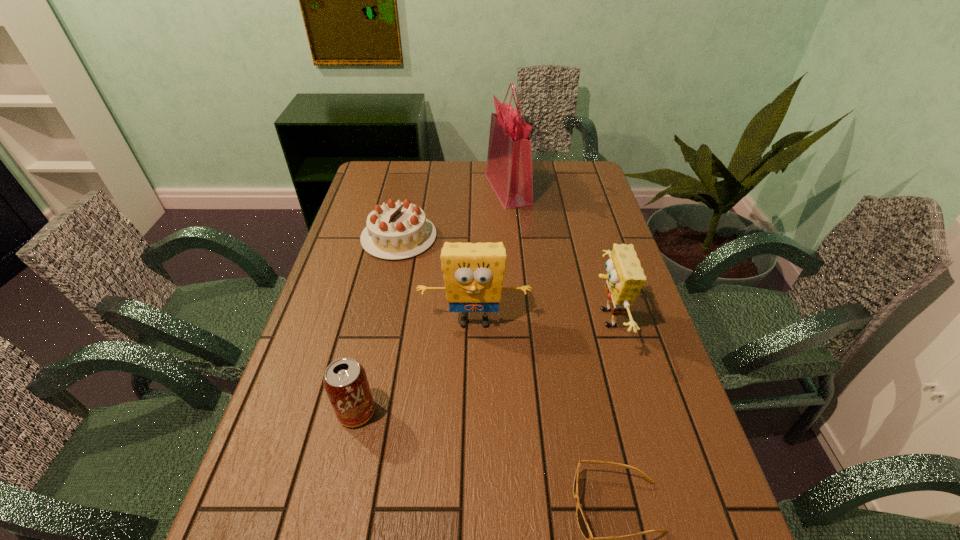
This screenshot has width=960, height=540. Identify the location of blank space located on the face of the right sponge. (456, 319).

You are a GUI agent. You are given a task and a screenshot of the screen. Output one action in this format:
    pyautogui.click(x=<x>, y=<y>)
    Task: Click on the blank area located on the face of the right sponge
    This screenshot has width=960, height=540.
    Given the screenshot: What is the action you would take?
    pyautogui.click(x=534, y=319)

I want to click on free space located on the face of the right sponge, so click(552, 319).

Where is `vacant space located 0.390m on the back of the fifth farthest object`? This screenshot has width=960, height=540. vacant space located 0.390m on the back of the fifth farthest object is located at coordinates (386, 280).

In order to click on vacant space situated 0.310m on the front of the birthday cake in this screenshot , I will do `click(376, 339)`.

At what (x,y) coordinates should I click in order to perform the action: click on object situated at the far edge. Please return your answer as a coordinate pair (x, y). The width and height of the screenshot is (960, 540). Looking at the image, I should click on (509, 170).

Find the location of `soda can that is at the left edge`. soda can that is at the left edge is located at coordinates (345, 381).

You are a GUI agent. You are given a task and a screenshot of the screen. Output one action in this format:
    pyautogui.click(x=<x>, y=<y>)
    Task: Click on the birthday cake located at the left edge
    
    Given the screenshot: What is the action you would take?
    pyautogui.click(x=397, y=230)

The image size is (960, 540). Find the location of `object present at the right edge`. object present at the right edge is located at coordinates (625, 278).

In the image, there is a desktop. In order to click on vacant area at the far edge in this screenshot , I will do `click(546, 181)`.